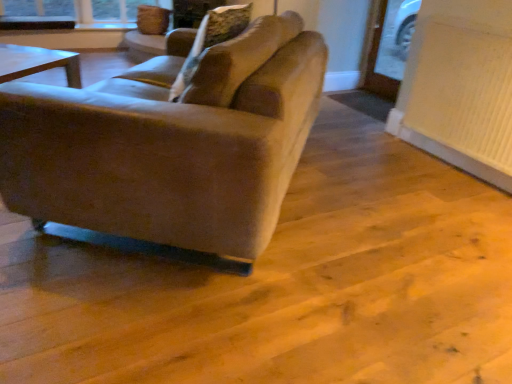
Question: Is suede-like beige pillow at center wider or thinner than white textured radiator at lower right?

Choices:
 (A) wide
 (B) thin

Answer: (A)

Question: From the image's perspective, is suede-like beige pillow at center positioned above or below white textured radiator at lower right?

Choices:
 (A) above
 (B) below

Answer: (A)

Question: Which of these objects is positioned closest to the suede-like beige pillow at center?

Choices:
 (A) white textured radiator at lower right
 (B) suede-like beige couch at center

Answer: (B)

Question: Which object is positioned farthest from the suede-like beige pillow at center?

Choices:
 (A) suede-like beige couch at center
 (B) white textured radiator at lower right

Answer: (B)